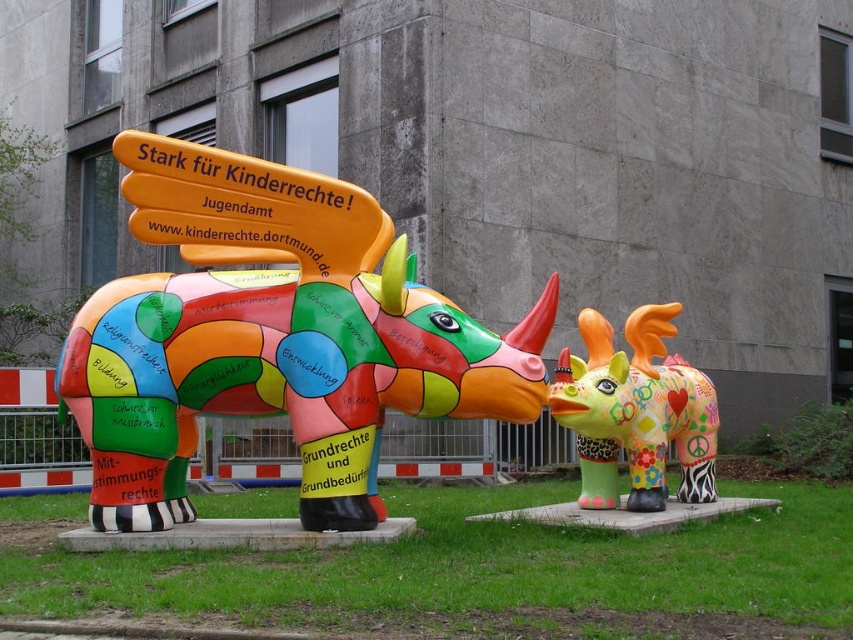
You are a photographer trying to capture both the green grass at lower center and the multicolored painted rhino at center in a single shot. Which object will appear larger in the photo?

The multicolored painted rhino at center will appear larger in the photo because it is bigger than the green grass at lower center.

You are a gardener who wants to mow the green grass at lower center. Can you reach the grass with your lawnmower if the multicolored painted rhino at center is blocking the path?

The green grass at lower center has a lesser height compared to the multicolored painted rhino at center, so the rhino is blocking the path. Therefore, you cannot reach the grass with your lawnmower.